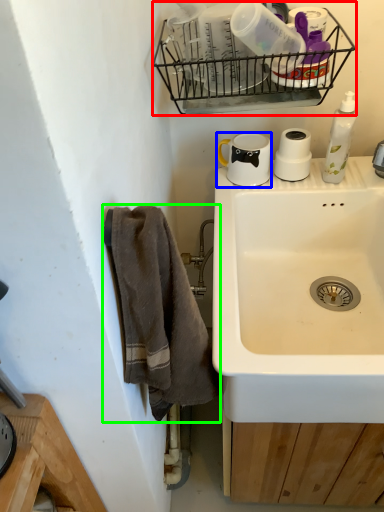
Question: Which is farther away from basket (highlighted by a red box)? coffee cup (highlighted by a blue box) or towel/napkin (highlighted by a green box)?

Choices:
 (A) coffee cup
 (B) towel/napkin

Answer: (B)